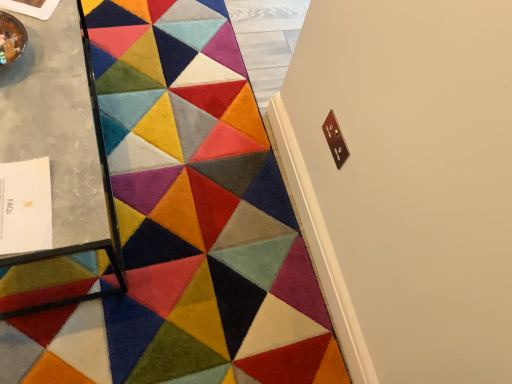
Question: Should I look upward or downward to see velvety multicolored rug at center?

Choices:
 (A) up
 (B) down

Answer: (A)

Question: Is metallic glass table at left further to the viewer compared to velvety multicolored rug at center?

Choices:
 (A) no
 (B) yes

Answer: (A)

Question: Are metallic glass table at left and velvety multicolored rug at center making contact?

Choices:
 (A) yes
 (B) no

Answer: (B)

Question: Considering the relative positions of metallic glass table at left and velvety multicolored rug at center in the image provided, is metallic glass table at left to the right of velvety multicolored rug at center from the viewer's perspective?

Choices:
 (A) no
 (B) yes

Answer: (A)

Question: Is metallic glass table at left oriented away from velvety multicolored rug at center?

Choices:
 (A) yes
 (B) no

Answer: (B)

Question: Does metallic glass table at left have a lesser height compared to velvety multicolored rug at center?

Choices:
 (A) yes
 (B) no

Answer: (B)

Question: Is metallic glass table at left outside of velvety multicolored rug at center?

Choices:
 (A) yes
 (B) no

Answer: (A)

Question: Is velvety multicolored rug at center in front of metallic glass table at left?

Choices:
 (A) no
 (B) yes

Answer: (A)

Question: From a real-world perspective, is velvety multicolored rug at center on metallic glass table at left?

Choices:
 (A) no
 (B) yes

Answer: (A)

Question: Considering the relative sizes of velvety multicolored rug at center and metallic glass table at left in the image provided, is velvety multicolored rug at center wider than metallic glass table at left?

Choices:
 (A) yes
 (B) no

Answer: (B)

Question: Is metallic glass table at left located within velvety multicolored rug at center?

Choices:
 (A) no
 (B) yes

Answer: (A)

Question: Can you see velvety multicolored rug at center touching metallic glass table at left?

Choices:
 (A) no
 (B) yes

Answer: (A)

Question: Would you say velvety multicolored rug at center is outside metallic glass table at left?

Choices:
 (A) no
 (B) yes

Answer: (B)

Question: From the image's perspective, is metallic glass table at left above or below velvety multicolored rug at center?

Choices:
 (A) above
 (B) below

Answer: (A)